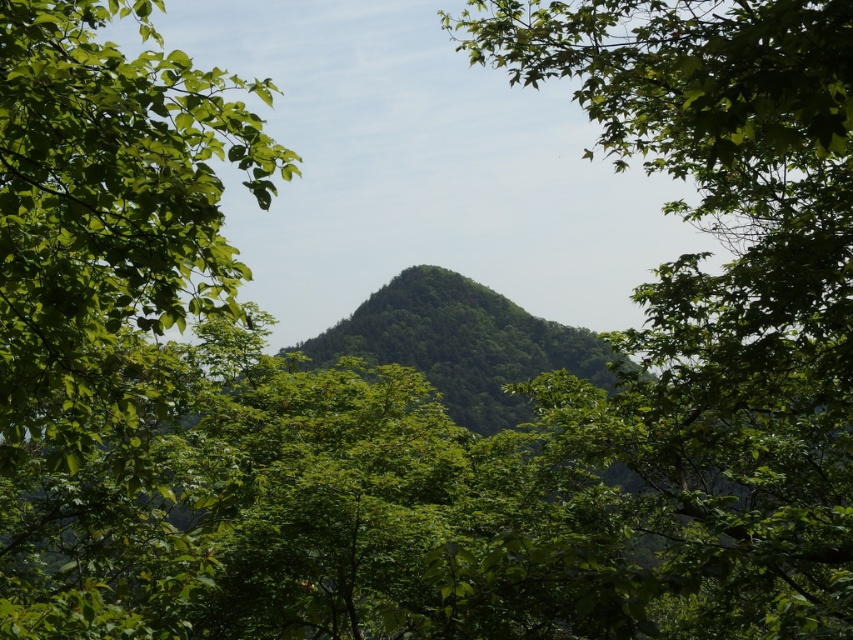
Question: Among these objects, which one is farthest from the camera?

Choices:
 (A) green leafy tree at center
 (B) green leafy hillside at center

Answer: (B)

Question: Is green leafy tree at center thinner than green leafy hillside at center?

Choices:
 (A) no
 (B) yes

Answer: (A)

Question: Is green leafy tree at center thinner than green leafy hillside at center?

Choices:
 (A) no
 (B) yes

Answer: (A)

Question: Which point is farther from the camera taking this photo?

Choices:
 (A) (497, 392)
 (B) (732, 620)

Answer: (A)

Question: Can you confirm if green leafy tree at center is bigger than green leafy hillside at center?

Choices:
 (A) yes
 (B) no

Answer: (A)